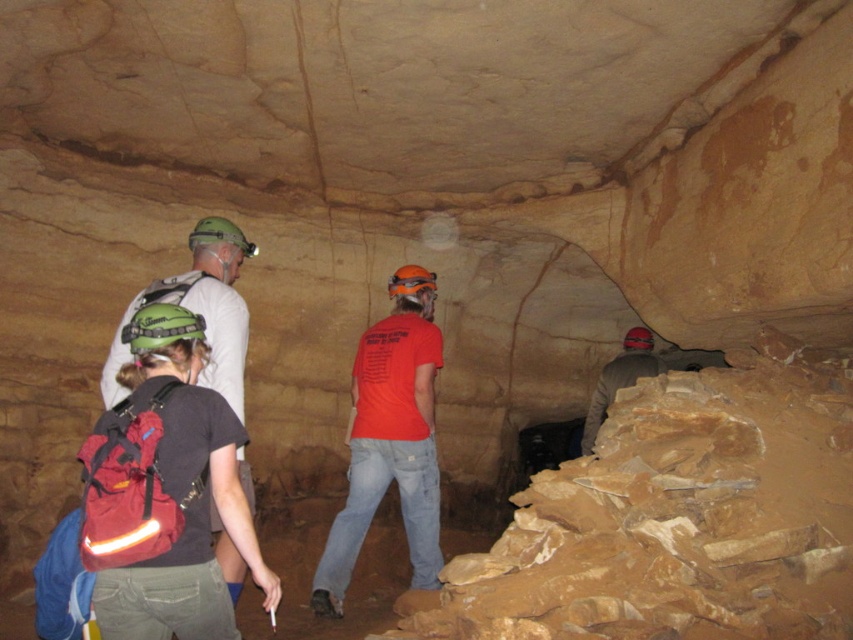
You are a member of the cave exploration team. You need to pass an object to your teammate who is holding the matte gray jacket at right. You have a tool that is 9 feet long. Can you safely hand it to them without leaving your current position near the matte green helmet at upper left?

The matte green helmet at upper left is 8.91 feet from the matte gray jacket at right. Since the tool is 9 feet long, it can reach them, so yes, you can safely hand it to them without moving.

You are part of the cave exploration team and need to determine clothing sizes for a group photo. Which of the two items, the orange fabric shirt at center or the matte gray jacket at right, would require a larger clothing size tag?

The orange fabric shirt at center requires a larger clothing size tag because it is larger in size than the matte gray jacket at right.

You are part of the cave exploration team and need to determine if the matte green helmet at upper left is above the matte gray jacket at right. Based on the scene, can you confirm this?

Yes, the matte green helmet at upper left is positioned over the matte gray jacket at right, meaning it is above it.